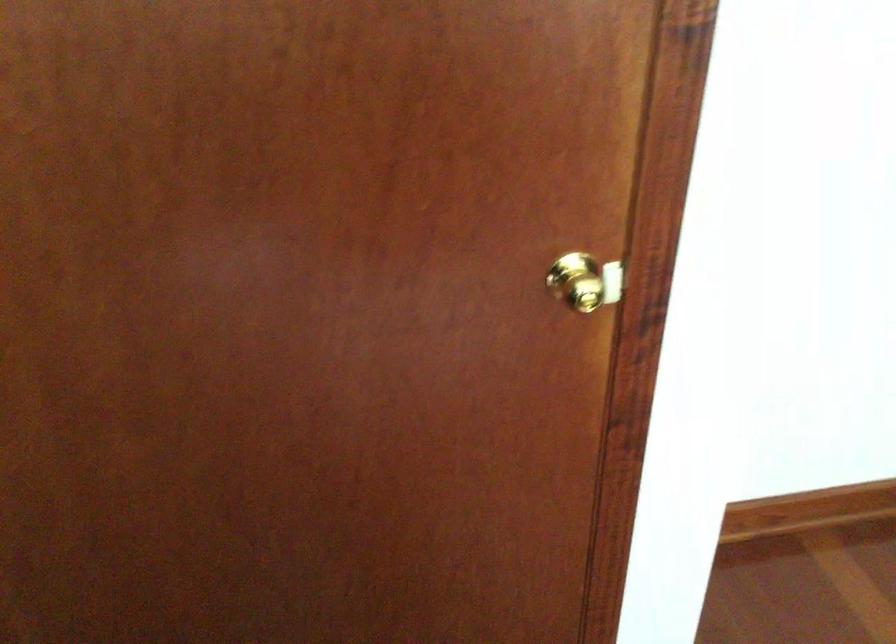
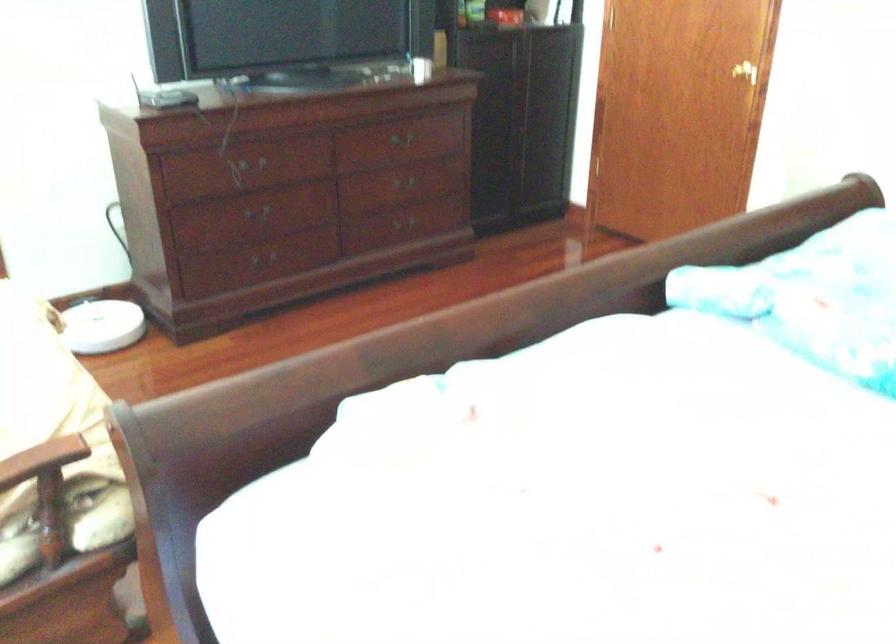
Locate, in the second image, the point that corresponds to pixel 624 289 in the first image.

(745, 71)